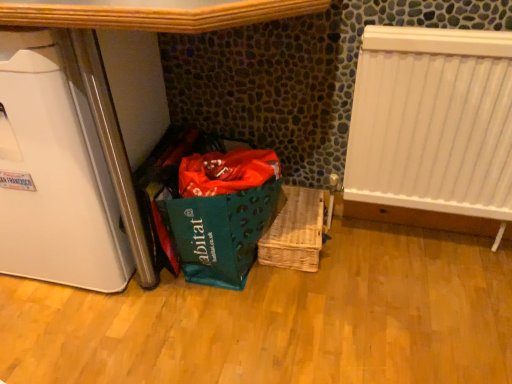
Where is `vacant area that lies between woven wood basket at center and white plastic radiator at right`? The height and width of the screenshot is (384, 512). vacant area that lies between woven wood basket at center and white plastic radiator at right is located at coordinates (385, 254).